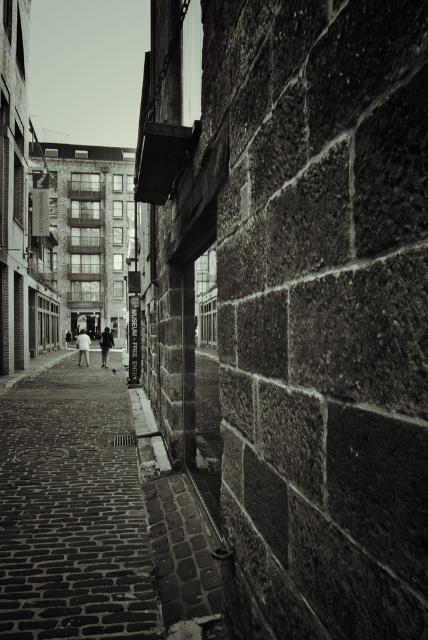
You are a delivery person carrying a white cotton shirt at center and need to walk on the smooth cobblestone pavement at center. Will the shirt stay flat on the pavement?

The smooth cobblestone pavement at center is thinner than the white cotton shirt at center, so the shirt will not stay flat because the pavement is narrower than the shirt.

You are a delivery person carrying a box and need to walk through the alley. You see the smooth cobblestone pavement at center and the white cotton shirt at center. Which surface is lower to the ground?

The smooth cobblestone pavement at center is not as tall as the white cotton shirt at center, so the pavement is lower to the ground.

You are a delivery person carrying a white cotton shirt at center and need to walk on the smooth cobblestone pavement at center. Can you safely step on the pavement while holding the shirt?

The smooth cobblestone pavement at center is in front of the white cotton shirt at center, so yes, you can safely step on the pavement while holding the shirt since it is positioned ahead of you.